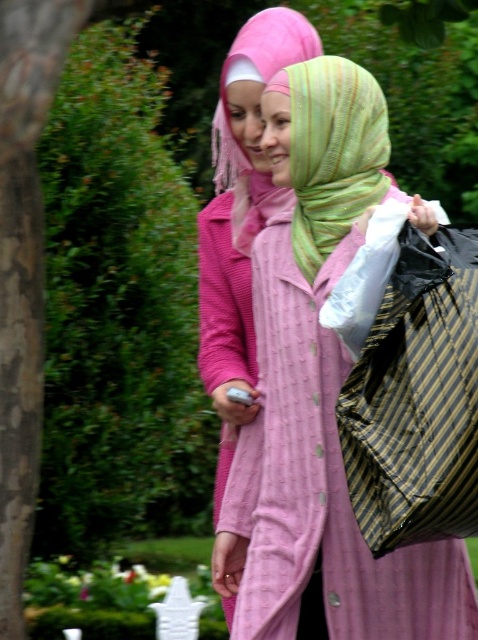
You are a photographer trying to capture a photo of both individuals in the scene. You notice two points marked in the image at coordinates point (x=316, y=484) and point (x=370, y=109). Since you want to ensure both are in focus, which point should you focus on to maximize the chances of both being sharp?

You should focus on point (x=370, y=109) because it is closer to the camera than point (x=316, y=484). By focusing on the closer point, the depth of field will extend backward, increasing the likelihood that both points are in focus.

You are a photographer trying to capture a candid shot of the two people in the image. You notice a point at coordinates (x=416, y=397). Where is this point located in relation to the striped fabric bag at right?

The point at coordinates (x=416, y=397) is located on the striped fabric bag at right.

You are a photographer trying to capture a candid shot of the two people in the scene. You want to ensure that the striped fabric bag at right and the green striped scarf at center are both visible in the frame. Based on their positions, which object is farther to the right?

A: The striped fabric bag at right is farther to the right compared to the green striped scarf at center because it is positioned to the right of it.